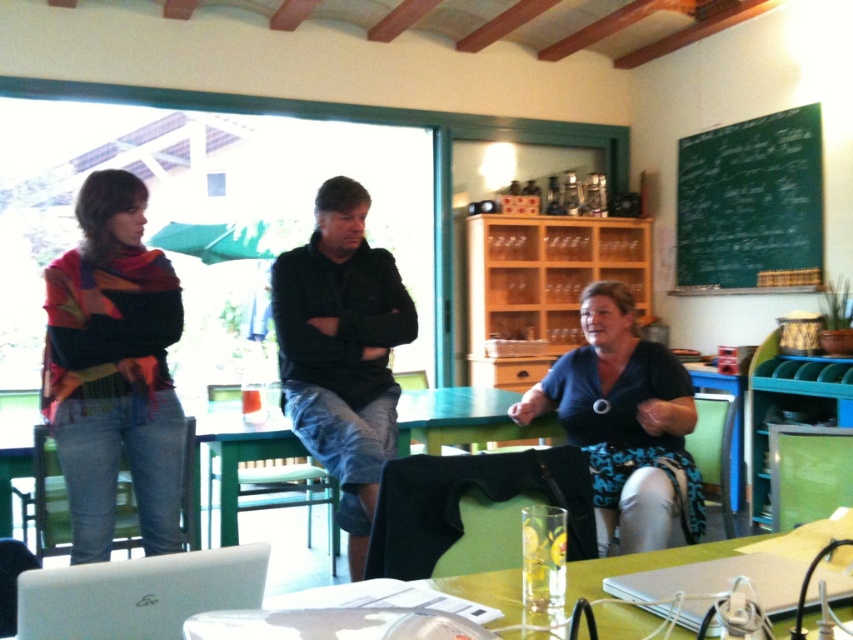
Does multicolored scarf at left appear over green glossy table at lower center?

Correct, multicolored scarf at left is located above green glossy table at lower center.

Is multicolored scarf at left to the right of green glossy table at lower center from the viewer's perspective?

No, multicolored scarf at left is not to the right of green glossy table at lower center.

Image resolution: width=853 pixels, height=640 pixels. What are the coordinates of `multicolored scarf at left` in the screenshot? It's located at (113, 369).

Find the location of `multicolored scarf at left`. multicolored scarf at left is located at coordinates (113, 369).

Can you confirm if green chalkboard at upper right is taller than white matte laptop at lower left?

Yes, green chalkboard at upper right is taller than white matte laptop at lower left.

Consider the image. Between green chalkboard at upper right and white matte laptop at lower left, which one is positioned lower?

white matte laptop at lower left is lower down.

The height and width of the screenshot is (640, 853). Describe the element at coordinates (749, 198) in the screenshot. I see `green chalkboard at upper right` at that location.

Locate an element on the screen. green chalkboard at upper right is located at coordinates (749, 198).

Can you confirm if black cotton shirt at center is positioned to the right of green chalkboard at upper right?

No, black cotton shirt at center is not to the right of green chalkboard at upper right.

The height and width of the screenshot is (640, 853). What do you see at coordinates (341, 352) in the screenshot?
I see `black cotton shirt at center` at bounding box center [341, 352].

Find the location of a particular element. The height and width of the screenshot is (640, 853). black cotton shirt at center is located at coordinates (341, 352).